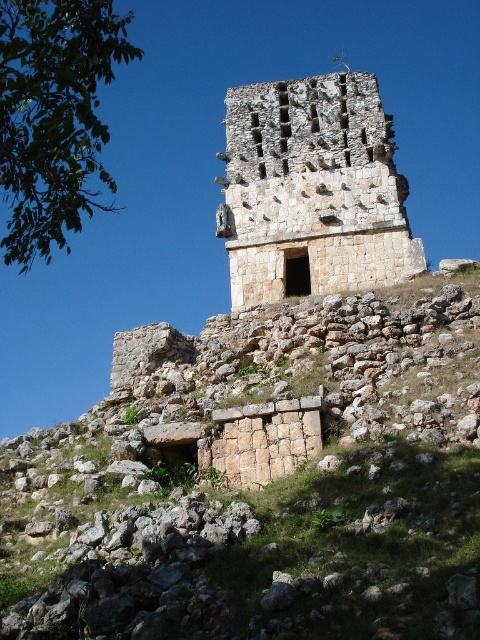
You are standing at the base of the ancient stone structure and want to locate the rustic stone wall at center. According to the coordinates provided, where should you look relative to the center of the image?

The rustic stone wall at center is located at coordinates point (x=262, y=477), which is slightly to the right and a bit below the exact center of the image.

Based on the scene described, which object is taller between the rustic stone wall at center and the rustic stone tower at center?

The rustic stone tower at center is taller than the rustic stone wall at center.